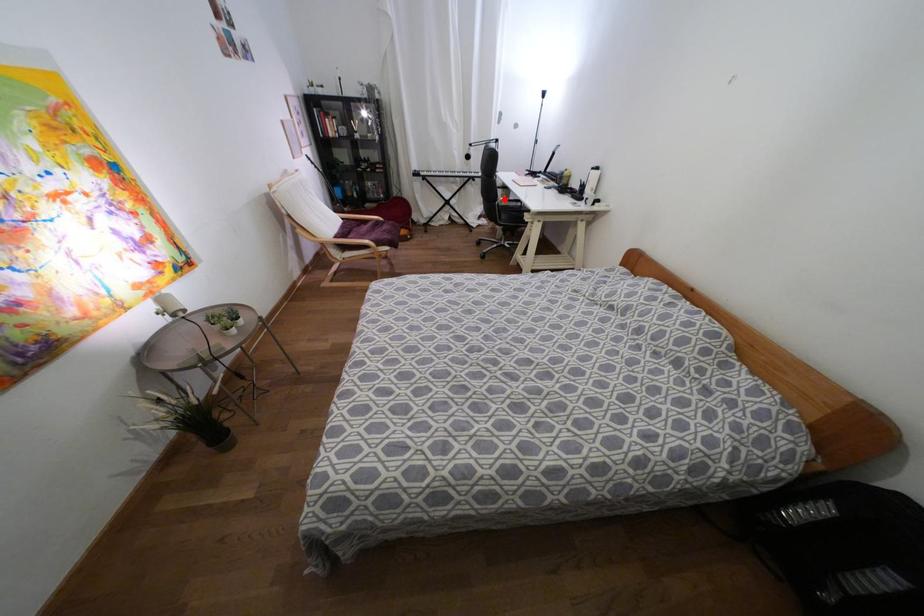
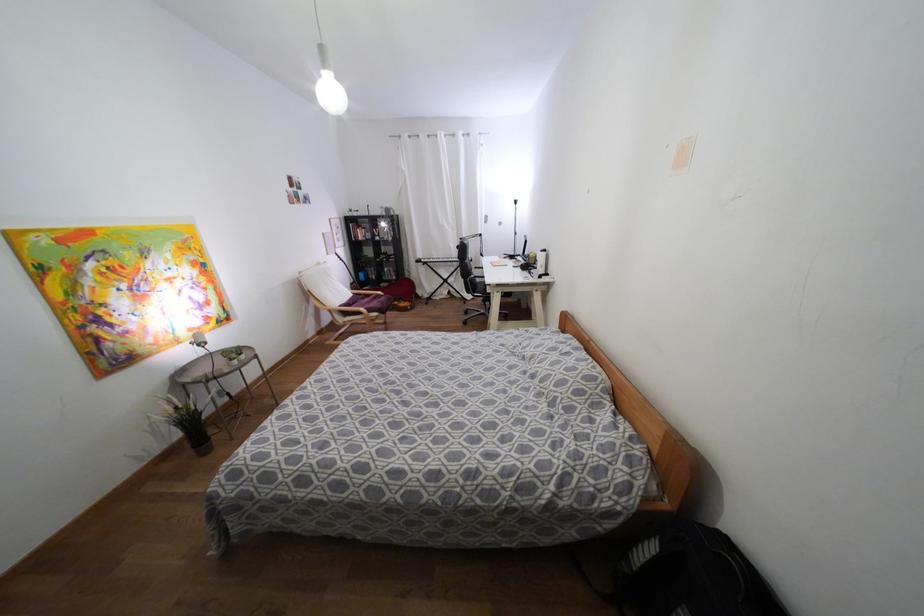
Question: I am providing you with two images of the same scene from different viewpoints. In image1, a red point is highlighted. Considering the same 3D point in image2, which of the following is correct?

Choices:
 (A) It is closer
 (B) It is farther

Answer: (B)